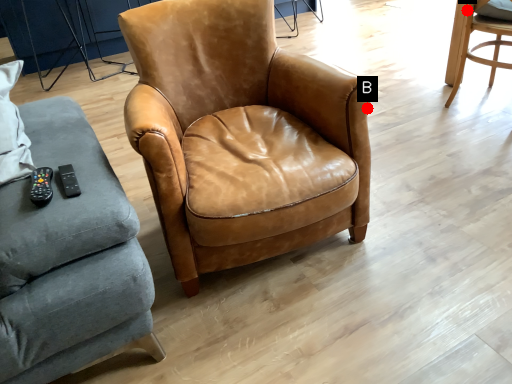
Question: Two points are circled on the image, labeled by A and B beside each circle. Which point is farther to the camera?

Choices:
 (A) A is further
 (B) B is further

Answer: (A)